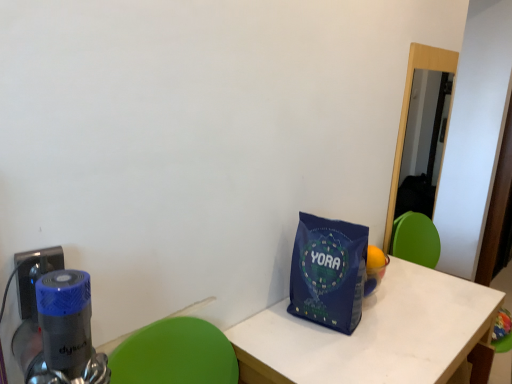
This screenshot has width=512, height=384. Find the location of `blue plastic electric outlet at lower left`. blue plastic electric outlet at lower left is located at coordinates (34, 276).

The width and height of the screenshot is (512, 384). What are the coordinates of `blue plastic electric outlet at lower left` in the screenshot? It's located at (34, 276).

Is white matte table at center far from blue plastic electric outlet at lower left?

That's not correct — white matte table at center is a little close to blue plastic electric outlet at lower left.

Is white matte table at center turned away from blue plastic electric outlet at lower left?

No.

Looking at this image, is white matte table at center spatially inside blue plastic electric outlet at lower left, or outside of it?

white matte table at center is outside blue plastic electric outlet at lower left.

Between point (409, 278) and point (25, 272), which one is positioned in front?

The point (25, 272) is more forward.

There is a blue fabric tote bag at lower right. At what (x,y) coordinates should I click in order to perform the action: click on electric outlet above it (from a real-world perspective). Please return your answer as a coordinate pair (x, y). Looking at the image, I should click on (34, 276).

Considering the sizes of blue plastic electric outlet at lower left and blue fabric tote bag at lower right in the image, is blue plastic electric outlet at lower left taller or shorter than blue fabric tote bag at lower right?

Clearly, blue plastic electric outlet at lower left is shorter compared to blue fabric tote bag at lower right.

Considering the relative sizes of blue plastic electric outlet at lower left and blue fabric tote bag at lower right in the image provided, is blue plastic electric outlet at lower left thinner than blue fabric tote bag at lower right?

Yes.

In the scene shown: Considering the positions of objects blue plastic electric outlet at lower left and blue fabric tote bag at lower right in the image provided, who is more to the left, blue plastic electric outlet at lower left or blue fabric tote bag at lower right?

Positioned to the left is blue plastic electric outlet at lower left.

Considering the positions of objects blue fabric tote bag at lower right and white matte table at center in the image provided, who is more to the left, blue fabric tote bag at lower right or white matte table at center?

blue fabric tote bag at lower right is more to the left.

Is blue fabric tote bag at lower right positioned before white matte table at center?

That is False.

From the picture: Is blue fabric tote bag at lower right positioned with its back to white matte table at center?

No, blue fabric tote bag at lower right's orientation is not away from white matte table at center.

From the picture: From their relative heights in the image, would you say blue fabric tote bag at lower right is taller or shorter than white matte table at center?

Clearly, blue fabric tote bag at lower right is shorter compared to white matte table at center.

Looking at this image, does blue plastic electric outlet at lower left come behind white matte table at center?

No, blue plastic electric outlet at lower left is closer to the viewer.

Is point (23, 309) closer to camera compared to point (451, 330)?

Yes, point (23, 309) is closer to viewer.

Between blue plastic electric outlet at lower left and white matte table at center, which one has less height?

blue plastic electric outlet at lower left.

Is blue plastic electric outlet at lower left wider or thinner than white matte table at center?

blue plastic electric outlet at lower left is thinner than white matte table at center.

Considering the relative sizes of white matte table at center and blue fabric tote bag at lower right in the image provided, is white matte table at center bigger than blue fabric tote bag at lower right?

Indeed, white matte table at center has a larger size compared to blue fabric tote bag at lower right.

Could blue fabric tote bag at lower right be considered to be inside white matte table at center?

No, blue fabric tote bag at lower right is not inside white matte table at center.

Is white matte table at center not near blue fabric tote bag at lower right?

No, there isn't a large distance between white matte table at center and blue fabric tote bag at lower right.

Is blue fabric tote bag at lower right in contact with blue plastic electric outlet at lower left?

No.

Is point (317, 217) in front of point (52, 247)?

No, it is behind (52, 247).

Considering the relative positions of blue fabric tote bag at lower right and blue plastic electric outlet at lower left in the image provided, is blue fabric tote bag at lower right in front of blue plastic electric outlet at lower left?

No, the depth of blue fabric tote bag at lower right is greater than that of blue plastic electric outlet at lower left.

Find the location of a particular element. The image size is (512, 384). tote bag behind the blue plastic electric outlet at lower left is located at coordinates (328, 272).

Locate an element on the screen. table located below the blue plastic electric outlet at lower left (from the image's perspective) is located at coordinates (374, 334).

At what (x,y) coordinates should I click in order to perform the action: click on electric outlet above the blue fabric tote bag at lower right (from a real-world perspective). Please return your answer as a coordinate pair (x, y). Looking at the image, I should click on (34, 276).

From the image, which object appears to be nearer to white matte table at center, blue fabric tote bag at lower right or blue plastic electric outlet at lower left?

The object closer to white matte table at center is blue fabric tote bag at lower right.

Based on their spatial positions, is blue fabric tote bag at lower right or white matte table at center further from blue plastic electric outlet at lower left?

Based on the image, white matte table at center appears to be further to blue plastic electric outlet at lower left.

Estimate the real-world distances between objects in this image. Which object is closer to blue plastic electric outlet at lower left, white matte table at center or blue fabric tote bag at lower right?

The object closer to blue plastic electric outlet at lower left is blue fabric tote bag at lower right.

Estimate the real-world distances between objects in this image. Which object is closer to white matte table at center, blue plastic electric outlet at lower left or blue fabric tote bag at lower right?

Based on the image, blue fabric tote bag at lower right appears to be nearer to white matte table at center.

Estimate the real-world distances between objects in this image. Which object is further from blue fabric tote bag at lower right, blue plastic electric outlet at lower left or white matte table at center?

blue plastic electric outlet at lower left is further to blue fabric tote bag at lower right.

From the image, which object appears to be nearer to blue fabric tote bag at lower right, white matte table at center or blue plastic electric outlet at lower left?

Based on the image, white matte table at center appears to be nearer to blue fabric tote bag at lower right.

Image resolution: width=512 pixels, height=384 pixels. In order to click on tote bag between blue plastic electric outlet at lower left and white matte table at center in the horizontal direction in this screenshot , I will do `click(328, 272)`.